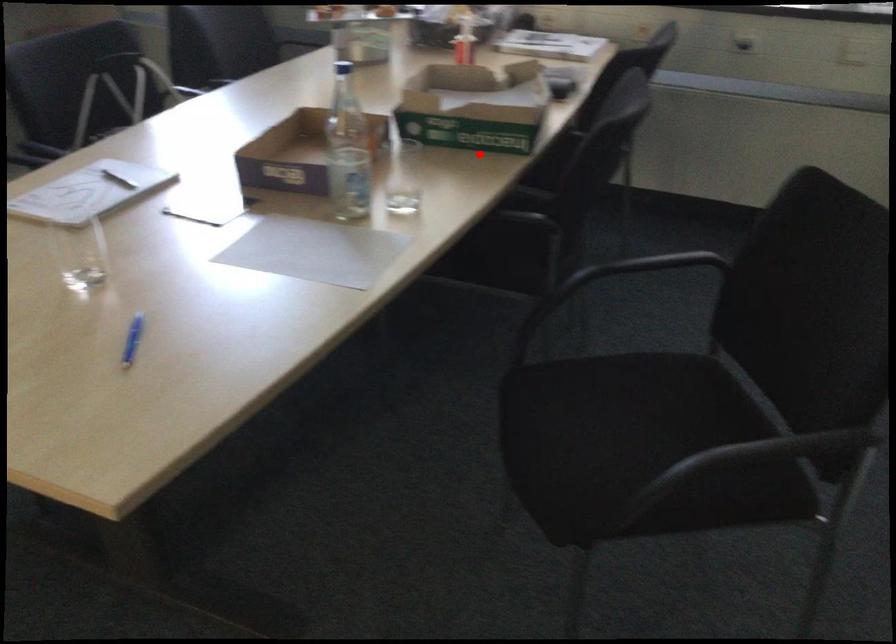
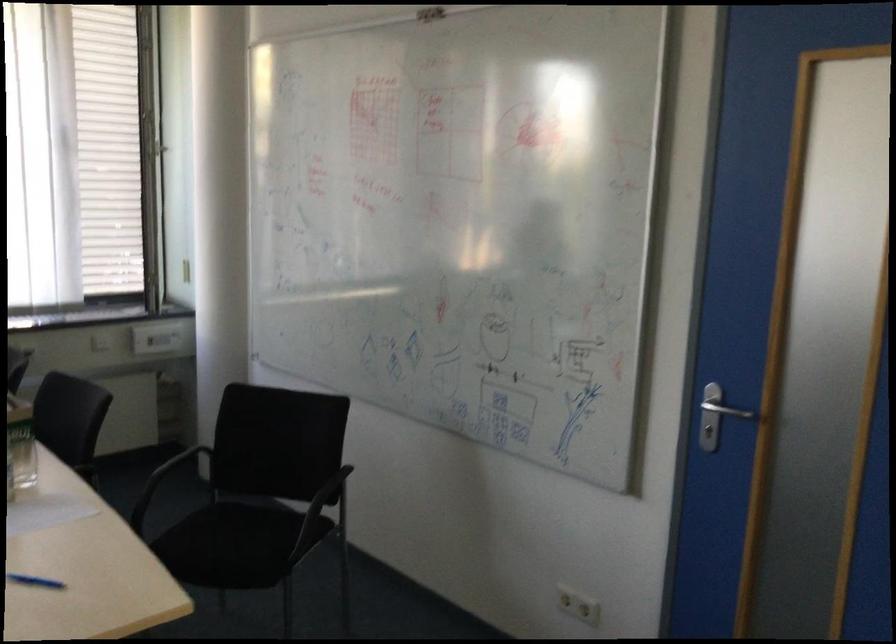
Where in the second image is the point corresponding to the highlighted location from the first image?

(21, 444)